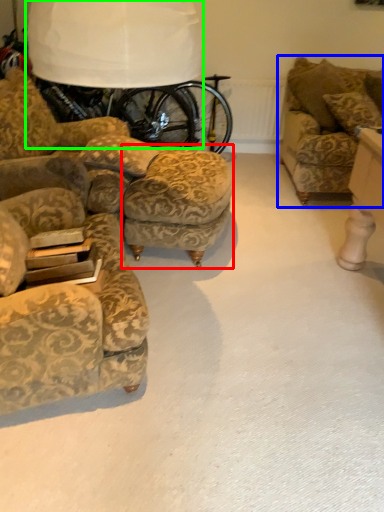
Question: Which object is positioned farthest from stool (highlighted by a red box)? Select from studio couch (highlighted by a blue box) and table lamp (highlighted by a green box).

Choices:
 (A) studio couch
 (B) table lamp

Answer: (A)